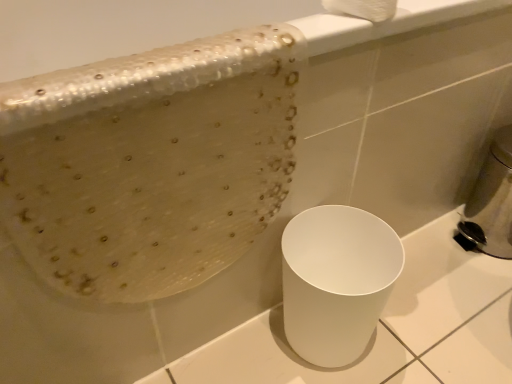
Question: From a real-world perspective, is white glossy trash can at lower right above or below white fluffy toilet paper at upper center?

Choices:
 (A) below
 (B) above

Answer: (A)

Question: In terms of height, does white glossy trash can at lower right look taller or shorter compared to white fluffy toilet paper at upper center?

Choices:
 (A) tall
 (B) short

Answer: (A)

Question: Which of these objects is positioned farthest from the white fluffy toilet paper at upper center?

Choices:
 (A) metallic silver soap dispenser at right
 (B) white glossy trash can at lower right

Answer: (A)

Question: Considering the real-world distances, which object is farthest from the metallic silver soap dispenser at right?

Choices:
 (A) white glossy trash can at lower right
 (B) white fluffy toilet paper at upper center

Answer: (B)